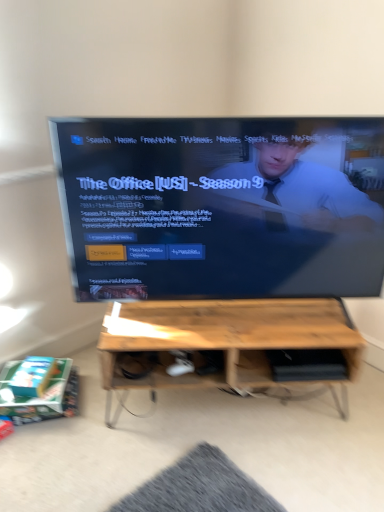
Locate an element on the screen. vacant area situated below matte black tv at center (from a real-world perspective) is located at coordinates (238, 321).